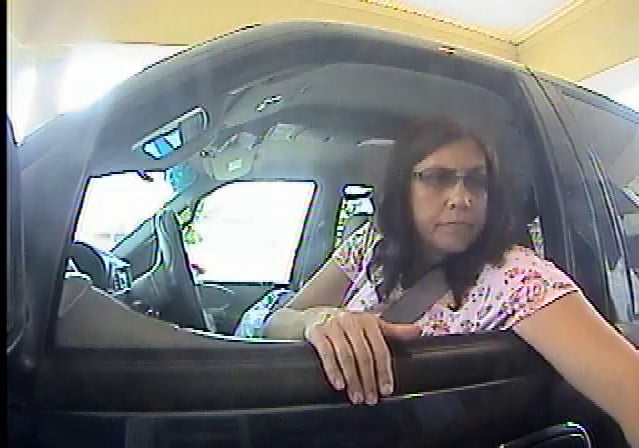
The image size is (639, 448). I want to click on window, so click(x=613, y=134).